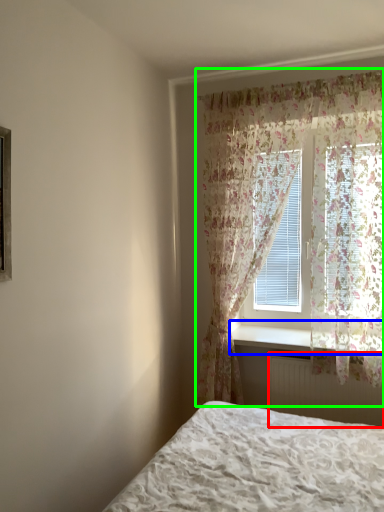
Question: Which is nearer to the radiator (highlighted by a red box)? window sill (highlighted by a blue box) or curtain (highlighted by a green box).

Choices:
 (A) window sill
 (B) curtain

Answer: (A)